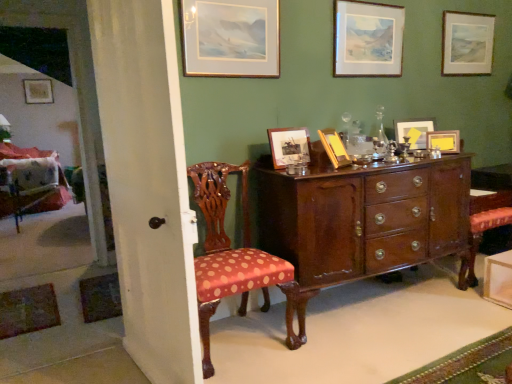
Question: Is matte gold picture frame at upper left, the 8th picture frame viewed from the right, oriented away from yellow paper at upper right, the 7th picture frame from the left?

Choices:
 (A) no
 (B) yes

Answer: (A)

Question: From a real-world perspective, is matte gold picture frame at upper left, the 8th picture frame viewed from the right, located higher than yellow paper at upper right, the fifth picture frame in the front-to-back sequence?

Choices:
 (A) yes
 (B) no

Answer: (A)

Question: Is the depth of matte gold picture frame at upper left, which ranks as the 1th picture frame in back-to-front order, greater than that of yellow paper at upper right, which appears as the second picture frame when viewed from the right?

Choices:
 (A) yes
 (B) no

Answer: (A)

Question: From a real-world perspective, is matte gold picture frame at upper left, placed as the eighth picture frame when sorted from front to back, located beneath yellow paper at upper right, which appears as the second picture frame when viewed from the right?

Choices:
 (A) yes
 (B) no

Answer: (B)

Question: Are matte gold picture frame at upper left, placed as the eighth picture frame when sorted from front to back, and yellow paper at upper right, the fifth picture frame in the front-to-back sequence, making contact?

Choices:
 (A) no
 (B) yes

Answer: (A)

Question: Is matte gold picture frame at upper left, placed as the eighth picture frame when sorted from front to back, not close to yellow paper at upper right, which is the fourth picture frame from back to front?

Choices:
 (A) yes
 (B) no

Answer: (A)

Question: Is polka dot fabric chair at left, which appears as the second chair when viewed from the left, further to the viewer compared to wooden picture frame at center, acting as the 6th picture frame starting from the back?

Choices:
 (A) yes
 (B) no

Answer: (B)

Question: Does polka dot fabric chair at left, the first chair from the right, have a greater height compared to wooden picture frame at center, which is the third picture frame in left-to-right order?

Choices:
 (A) yes
 (B) no

Answer: (A)

Question: Is polka dot fabric chair at left, which is the first chair from front to back, smaller than wooden picture frame at center, acting as the 6th picture frame starting from the back?

Choices:
 (A) no
 (B) yes

Answer: (A)

Question: Can you confirm if polka dot fabric chair at left, acting as the second chair starting from the back, is bigger than wooden picture frame at center, positioned as the 3th picture frame in front-to-back order?

Choices:
 (A) no
 (B) yes

Answer: (B)

Question: From the image's perspective, is polka dot fabric chair at left, which is the first chair from front to back, under wooden picture frame at center, acting as the 6th picture frame starting from the back?

Choices:
 (A) no
 (B) yes

Answer: (B)

Question: Considering the relative sizes of polka dot fabric chair at left, acting as the second chair starting from the back, and wooden picture frame at center, acting as the 6th picture frame starting from the back, in the image provided, is polka dot fabric chair at left, acting as the second chair starting from the back, wider than wooden picture frame at center, acting as the 6th picture frame starting from the back,?

Choices:
 (A) yes
 (B) no

Answer: (A)

Question: Is polished wood cabinet at center positioned in front of matte wooden picture frame at upper right, the eighth picture frame when ordered from left to right?

Choices:
 (A) no
 (B) yes

Answer: (B)